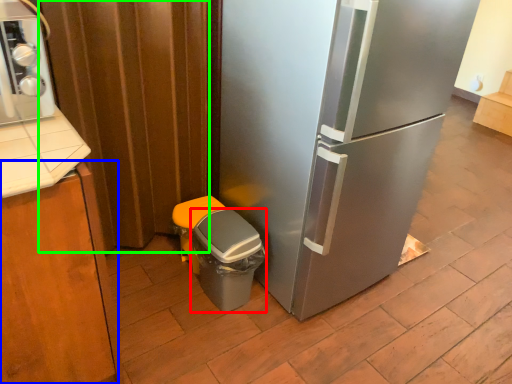
Question: Estimate the real-world distances between objects in this image. Which object is closer to potty (highlighted by a red box), cabinetry (highlighted by a blue box) or curtain (highlighted by a green box)?

Choices:
 (A) cabinetry
 (B) curtain

Answer: (B)